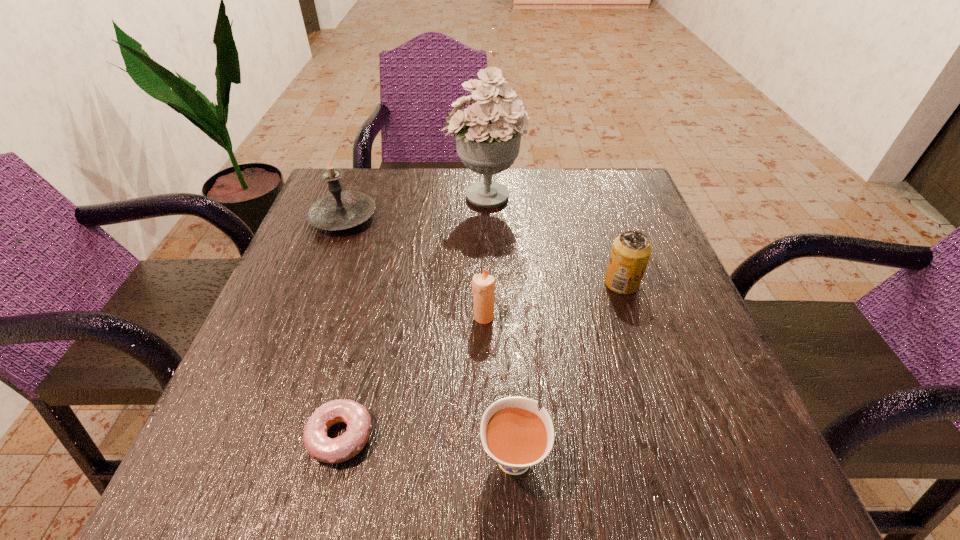
At what (x,y) coordinates should I click in order to perform the action: click on vacant space at the near left corner. Please return your answer as a coordinate pair (x, y). Looking at the image, I should click on (217, 462).

Find the location of `vacant space at the far right corner of the desktop`. vacant space at the far right corner of the desktop is located at coordinates (617, 174).

At what (x,y) coordinates should I click in order to perform the action: click on empty space that is in between the teacup and the nearer candle. Please return your answer as a coordinate pair (x, y). Image resolution: width=960 pixels, height=540 pixels. Looking at the image, I should click on (498, 385).

Identify the location of vacant space that's between the third nearest object and the teacup. This screenshot has width=960, height=540. (498, 385).

This screenshot has height=540, width=960. I want to click on blank region between the right candle and the shortest object, so pos(412,376).

Identify the location of free space between the tallest object and the nearer candle. This screenshot has height=540, width=960. (484, 256).

The width and height of the screenshot is (960, 540). Identify the location of blank region between the shortest object and the teacup. pos(427,445).

Where is `vacant area that lies between the left candle and the shorter candle`? The height and width of the screenshot is (540, 960). vacant area that lies between the left candle and the shorter candle is located at coordinates (413, 267).

The height and width of the screenshot is (540, 960). In order to click on free space between the third nearest object and the left candle in this screenshot , I will do `click(413, 267)`.

Where is `empty space that is in between the nearer candle and the second shortest object`? This screenshot has height=540, width=960. empty space that is in between the nearer candle and the second shortest object is located at coordinates (498, 385).